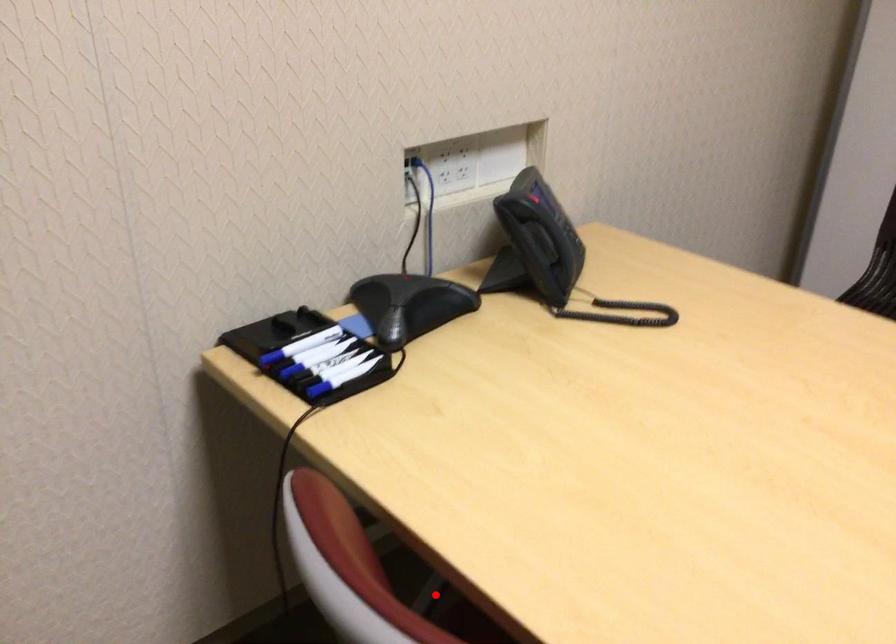
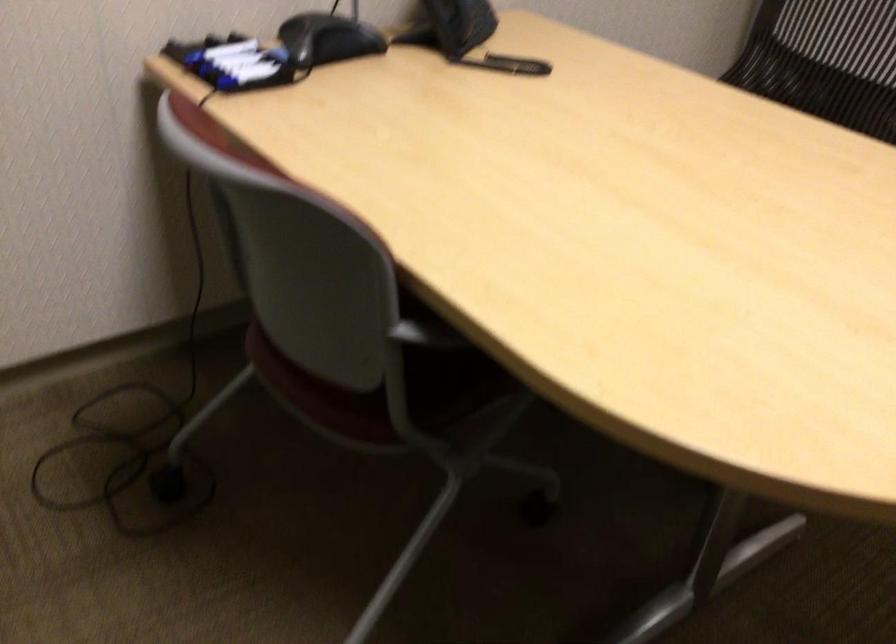
Question: I am providing you with two images of the same scene from different viewpoints. A red point is marked on the first image. At the location where the point appears in image 1, is it still visible in image 2?

Choices:
 (A) Yes
 (B) No

Answer: (B)